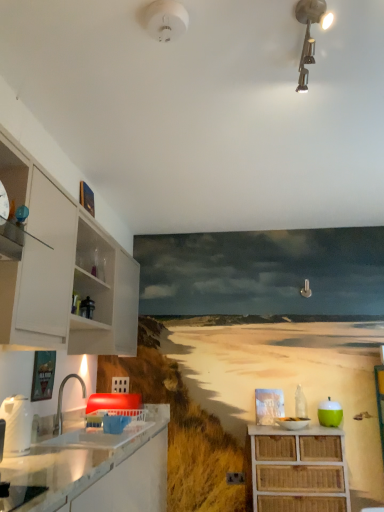
This screenshot has height=512, width=384. I want to click on white glossy countertop at lower left, so click(x=97, y=468).

What are the coordinates of `white glossy sink at lower left` in the screenshot? It's located at (103, 424).

Where is `white glossy cabinet at left, the 2th cabinetry when ordered from bottom to top`? This screenshot has height=512, width=384. white glossy cabinet at left, the 2th cabinetry when ordered from bottom to top is located at coordinates (63, 270).

Locate an element on the screen. The width and height of the screenshot is (384, 512). white glossy countertop at lower left is located at coordinates (97, 468).

Is white glossy countertop at lower left inside white glossy sink at lower left?

No, white glossy countertop at lower left is not surrounded by white glossy sink at lower left.

Looking at the image, does white glossy sink at lower left seem bigger or smaller compared to white glossy countertop at lower left?

white glossy sink at lower left is smaller than white glossy countertop at lower left.

Consider the image. Considering the sizes of white glossy sink at lower left and white glossy countertop at lower left in the image, is white glossy sink at lower left taller or shorter than white glossy countertop at lower left?

white glossy sink at lower left is shorter than white glossy countertop at lower left.

From a real-world perspective, which is physically below, white glossy sink at lower left or white glossy countertop at lower left?

white glossy countertop at lower left, from a real-world perspective.

Consider the image. From a real-world perspective, between white plastic smoke detector at upper center, which is the 2th light fixture in right-to-left order, and white glossy cabinet at left, the second cabinetry when ordered from right to left, who is vertically higher?

white plastic smoke detector at upper center, which is the 2th light fixture in right-to-left order.

Could you tell me if white plastic smoke detector at upper center, which is the 2th light fixture in right-to-left order, is facing white glossy cabinet at left, the first cabinetry positioned from the left?

No, white plastic smoke detector at upper center, which is the 2th light fixture in right-to-left order, does not turn towards white glossy cabinet at left, the first cabinetry positioned from the left.

Can you confirm if white plastic smoke detector at upper center, placed as the first light fixture when sorted from left to right, is thinner than white glossy cabinet at left, the first cabinetry positioned from the left?

Indeed, white plastic smoke detector at upper center, placed as the first light fixture when sorted from left to right, has a lesser width compared to white glossy cabinet at left, the first cabinetry positioned from the left.

From a real-world perspective, count 2nd light fixtures upward from the white glossy cabinet at left, the first cabinetry positioned from the left, and point to it. Please provide its 2D coordinates.

[(165, 20)]

From a real-world perspective, is white plastic smoke detector at upper center, placed as the first light fixture when sorted from left to right, positioned above or below white glossy sink at lower left?

white plastic smoke detector at upper center, placed as the first light fixture when sorted from left to right, is above white glossy sink at lower left.

Could you tell me if white plastic smoke detector at upper center, placed as the first light fixture when sorted from left to right, is facing white glossy sink at lower left?

No, white plastic smoke detector at upper center, placed as the first light fixture when sorted from left to right, is not turned towards white glossy sink at lower left.

Considering the sizes of objects white plastic smoke detector at upper center, which is the 2th light fixture in right-to-left order, and white glossy sink at lower left in the image provided, who is bigger, white plastic smoke detector at upper center, which is the 2th light fixture in right-to-left order, or white glossy sink at lower left?

With larger size is white glossy sink at lower left.

Is white plastic smoke detector at upper center, which is the 2th light fixture in right-to-left order, wider or thinner than white glossy sink at lower left?

Clearly, white plastic smoke detector at upper center, which is the 2th light fixture in right-to-left order, has less width compared to white glossy sink at lower left.

Locate an element on the screen. The image size is (384, 512). the 1st cabinetry positioned below the metallic track lighting at upper center, which is the second light fixture from left to right (from a real-world perspective) is located at coordinates (63, 270).

From a real-world perspective, is white glossy cabinet at left, the 2th cabinetry when ordered from bottom to top, positioned above or below metallic track lighting at upper center, which is the second light fixture from left to right?

Clearly, from a real-world perspective, white glossy cabinet at left, the 2th cabinetry when ordered from bottom to top, is below metallic track lighting at upper center, which is the second light fixture from left to right.

Which is in front, point (105, 342) or point (299, 72)?

The point (299, 72) is closer to the camera.

From the image's perspective, who appears lower, white glossy cabinet at left, the second cabinetry when ordered from right to left, or metallic track lighting at upper center, which is the second light fixture from left to right?

white glossy cabinet at left, the second cabinetry when ordered from right to left.

From the image's perspective, which is below, white plastic smoke detector at upper center, placed as the first light fixture when sorted from left to right, or white glossy countertop at lower left?

white glossy countertop at lower left appears lower in the image.

Considering the sizes of objects white plastic smoke detector at upper center, placed as the first light fixture when sorted from left to right, and white glossy countertop at lower left in the image provided, who is taller, white plastic smoke detector at upper center, placed as the first light fixture when sorted from left to right, or white glossy countertop at lower left?

With more height is white glossy countertop at lower left.

Are white plastic smoke detector at upper center, placed as the first light fixture when sorted from left to right, and white glossy countertop at lower left far apart?

Yes, white plastic smoke detector at upper center, placed as the first light fixture when sorted from left to right, and white glossy countertop at lower left are quite far apart.

Do you think white plastic smoke detector at upper center, which is the 2th light fixture in right-to-left order, is within white glossy countertop at lower left, or outside of it?

white plastic smoke detector at upper center, which is the 2th light fixture in right-to-left order, is located beyond the bounds of white glossy countertop at lower left.

Consider the image. Between green matte apple at right, which is the 2th appliance in front-to-back order, and woven wood cabinet at lower right, which ranks as the 2th cabinetry in left-to-right order, which one appears on the right side from the viewer's perspective?

green matte apple at right, which is the 2th appliance in front-to-back order, is more to the right.

Considering the positions of points (335, 416) and (259, 511), is point (335, 416) farther from camera compared to point (259, 511)?

Yes, point (335, 416) is farther from viewer.

Is green matte apple at right, which is the first appliance from bottom to top, closer to the viewer compared to woven wood cabinet at lower right, which ranks as the 2th cabinetry in left-to-right order?

No, it is behind woven wood cabinet at lower right, which ranks as the 2th cabinetry in left-to-right order.

Considering the sizes of objects green matte apple at right, which is the first appliance from bottom to top, and woven wood cabinet at lower right, which ranks as the 2th cabinetry in left-to-right order, in the image provided, who is shorter, green matte apple at right, which is the first appliance from bottom to top, or woven wood cabinet at lower right, which ranks as the 2th cabinetry in left-to-right order,?

With less height is green matte apple at right, which is the first appliance from bottom to top.

How many degrees apart are the facing directions of metallic track lighting at upper center, which is the second light fixture from left to right, and white glossy kettle at left, which ranks as the first appliance in front-to-back order?

There is a 86.7-degree angle between the facing directions of metallic track lighting at upper center, which is the second light fixture from left to right, and white glossy kettle at left, which ranks as the first appliance in front-to-back order.

Who is taller, metallic track lighting at upper center, which is the second light fixture from left to right, or white glossy kettle at left, placed as the 2th appliance when sorted from back to front?

white glossy kettle at left, placed as the 2th appliance when sorted from back to front.

From a real-world perspective, which appliance is the 1st one underneath the metallic track lighting at upper center, which is the second light fixture from left to right? Please provide its 2D coordinates.

[(17, 425)]

Can you confirm if metallic track lighting at upper center, which appears as the 1th light fixture when viewed from the right, is smaller than white glossy kettle at left, the 2th appliance in the right-to-left sequence?

Yes.

You are a GUI agent. You are given a task and a screenshot of the screen. Output one action in this format:
    pyautogui.click(x=<x>, y=<y>)
    Task: Click on the sink located above the white glossy countertop at lower left (from a real-world perspective)
    The height and width of the screenshot is (512, 384).
    Given the screenshot: What is the action you would take?
    pyautogui.click(x=103, y=424)

At what (x,y) coordinates should I click in order to perform the action: click on the 1st cabinetry positioned below the white plastic smoke detector at upper center, placed as the first light fixture when sorted from left to right (from a real-world perspective). Please return your answer as a coordinate pair (x, y). The image size is (384, 512). Looking at the image, I should click on (63, 270).

Considering their positions, is green matte apple at right, the second appliance in the top-to-bottom sequence, positioned closer to white plastic smoke detector at upper center, which is the 2th light fixture in right-to-left order, than white glossy cabinet at left, the 2th cabinetry when ordered from bottom to top?

Based on the image, white glossy cabinet at left, the 2th cabinetry when ordered from bottom to top, appears to be nearer to white plastic smoke detector at upper center, which is the 2th light fixture in right-to-left order.

Looking at this image, looking at the image, which one is located further to white glossy sink at lower left, white glossy countertop at lower left or white glossy cabinet at left, the 2th cabinetry when ordered from bottom to top?

white glossy cabinet at left, the 2th cabinetry when ordered from bottom to top, is further to white glossy sink at lower left.

Looking at this image, considering their positions, is white glossy kettle at left, placed as the 2th appliance when sorted from back to front, positioned further to white plastic smoke detector at upper center, placed as the first light fixture when sorted from left to right, than metallic track lighting at upper center, which appears as the 1th light fixture when viewed from the right?

white glossy kettle at left, placed as the 2th appliance when sorted from back to front.

Looking at the image, which one is located closer to metallic track lighting at upper center, which appears as the 1th light fixture when viewed from the right, white glossy cabinet at left, the second cabinetry when ordered from right to left, or woven wood cabinet at lower right, the first cabinetry in the right-to-left sequence?

white glossy cabinet at left, the second cabinetry when ordered from right to left.

Considering their positions, is green matte apple at right, the second appliance in the top-to-bottom sequence, positioned further to white glossy kettle at left, which ranks as the first appliance in front-to-back order, than white glossy countertop at lower left?

Based on the image, green matte apple at right, the second appliance in the top-to-bottom sequence, appears to be further to white glossy kettle at left, which ranks as the first appliance in front-to-back order.

Which object lies nearer to the anchor point white glossy countertop at lower left, metallic track lighting at upper center, which is the second light fixture from left to right, or white glossy kettle at left, the 2th appliance in the right-to-left sequence?

white glossy kettle at left, the 2th appliance in the right-to-left sequence.

When comparing their distances from white glossy sink at lower left, does white glossy kettle at left, the 2th appliance in the right-to-left sequence, or metallic track lighting at upper center, which appears as the 1th light fixture when viewed from the right, seem closer?

white glossy kettle at left, the 2th appliance in the right-to-left sequence.

From the image, which object appears to be farther from metallic track lighting at upper center, which is the second light fixture from left to right, woven wood cabinet at lower right, the second cabinetry when ordered from top to bottom, or white plastic smoke detector at upper center, placed as the first light fixture when sorted from left to right?

woven wood cabinet at lower right, the second cabinetry when ordered from top to bottom, lies further to metallic track lighting at upper center, which is the second light fixture from left to right, than the other object.

The image size is (384, 512). Identify the location of light fixture between white glossy cabinet at left, the first cabinetry positioned from the left, and green matte apple at right, the second appliance viewed from the left, from front to back. (165, 20).

Where is `appliance located between white glossy countertop at lower left and white glossy sink at lower left in the depth direction`? The image size is (384, 512). appliance located between white glossy countertop at lower left and white glossy sink at lower left in the depth direction is located at coordinates (17, 425).

This screenshot has height=512, width=384. Identify the location of appliance between white plastic smoke detector at upper center, placed as the first light fixture when sorted from left to right, and green matte apple at right, the second appliance in the top-to-bottom sequence, from top to bottom. (17, 425).

Where is `cabinetry between white glossy cabinet at left, the 2th cabinetry when ordered from bottom to top, and green matte apple at right, the first appliance positioned from the right`? Image resolution: width=384 pixels, height=512 pixels. cabinetry between white glossy cabinet at left, the 2th cabinetry when ordered from bottom to top, and green matte apple at right, the first appliance positioned from the right is located at coordinates (298, 470).